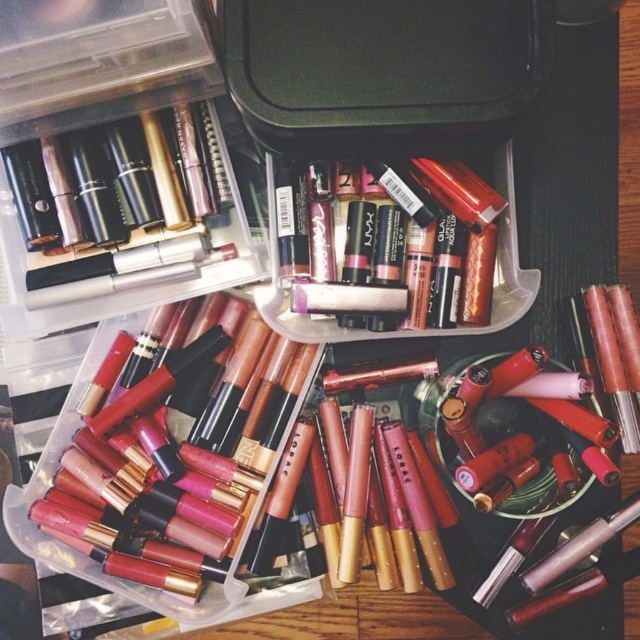
Can you confirm if matte gold lipstick at lower left is positioned below metallic gold lipstick at center?

Yes, matte gold lipstick at lower left is below metallic gold lipstick at center.

Is point (180, 467) closer to camera compared to point (500, 298)?

Yes, it is in front of point (500, 298).

This screenshot has width=640, height=640. What do you see at coordinates (195, 444) in the screenshot?
I see `matte gold lipstick at lower left` at bounding box center [195, 444].

The height and width of the screenshot is (640, 640). Identify the location of matte gold lipstick at lower left. (195, 444).